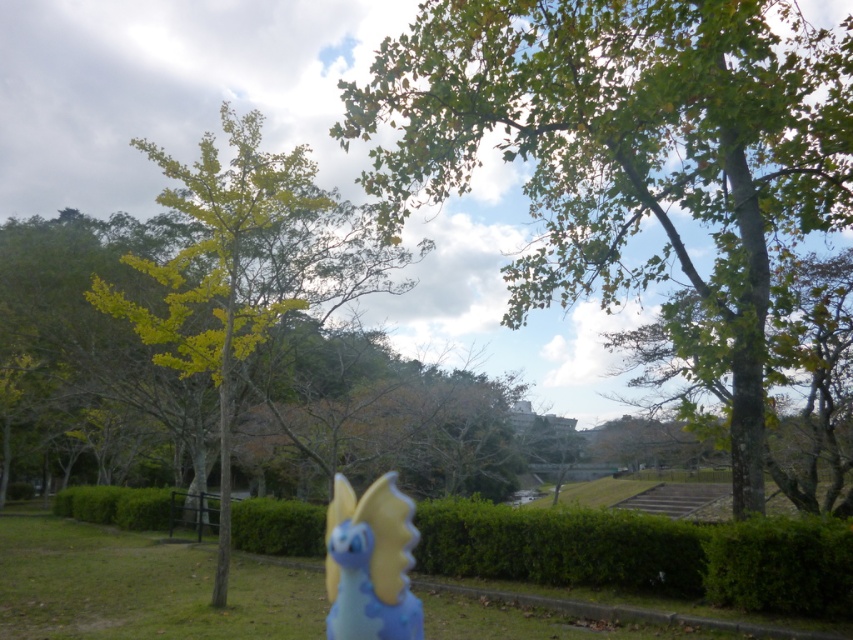
You are a photographer trying to capture a photo of the green leafy tree at upper center and the green hedge at lower center. Which object will appear larger in your photo?

The green leafy tree at upper center will appear larger in the photo because it is closer to the viewer than the green hedge at lower center.